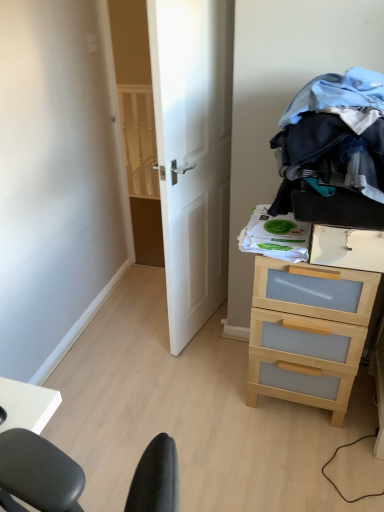
Question: Is denim fabric clothes at upper right wider or thinner than white wooden door at center?

Choices:
 (A) thin
 (B) wide

Answer: (B)

Question: In the image, is denim fabric clothes at upper right positioned in front of or behind white wooden door at center?

Choices:
 (A) front
 (B) behind

Answer: (A)

Question: Which object is the farthest from the light wood/ribbed drawer at right?

Choices:
 (A) white wooden door at center
 (B) denim fabric clothes at upper right

Answer: (A)

Question: Estimate the real-world distances between objects in this image. Which object is farther from the denim fabric clothes at upper right?

Choices:
 (A) white wooden door at center
 (B) light wood/ribbed drawer at right

Answer: (A)